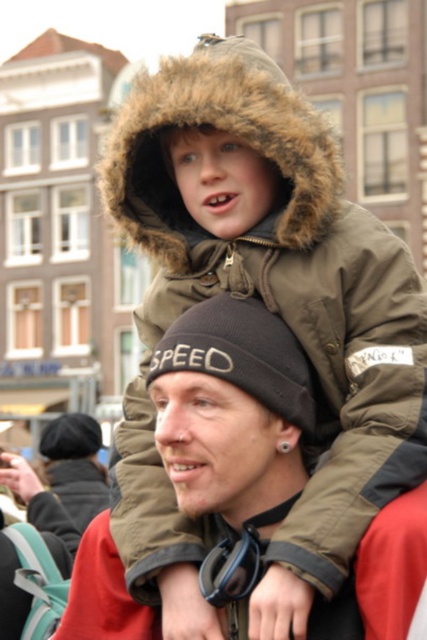
Question: Which point is closer to the camera?

Choices:
 (A) (251, 492)
 (B) (312, 564)

Answer: (B)

Question: Can you confirm if olive-green fur-lined jacket at center is positioned above black knit beanie at center?

Choices:
 (A) no
 (B) yes

Answer: (B)

Question: Among these objects, which one is nearest to the camera?

Choices:
 (A) olive-green fur-lined jacket at center
 (B) black knit beanie at center

Answer: (A)

Question: Does olive-green fur-lined jacket at center have a greater width compared to black knit beanie at center?

Choices:
 (A) no
 (B) yes

Answer: (B)

Question: Can you confirm if olive-green fur-lined jacket at center is positioned to the left of black knit beanie at center?

Choices:
 (A) no
 (B) yes

Answer: (B)